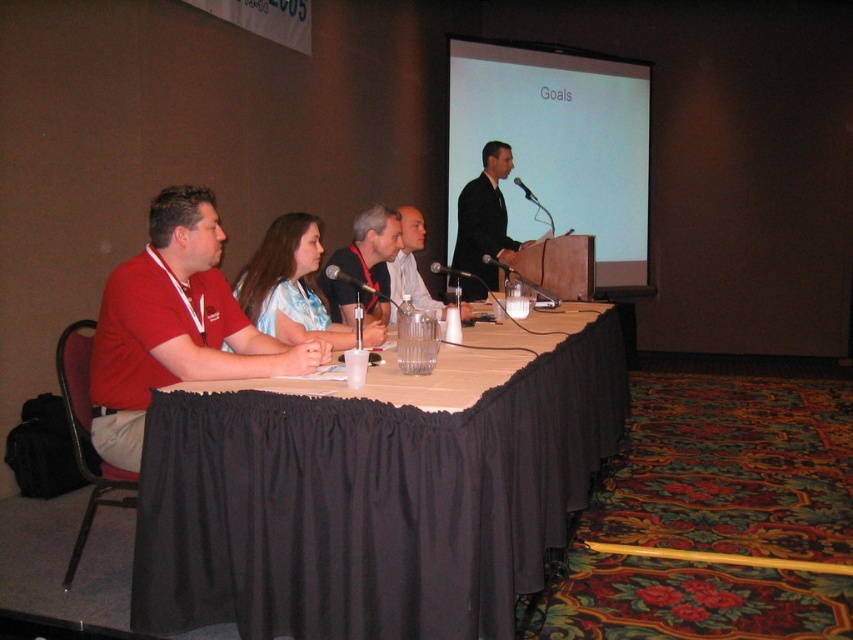
You are an attendee at this meeting and want to present a slide from the white matte projection screen at upper center to the person in the black suit at center. Can you directly hand the slide to them without moving from your seat?

The white matte projection screen at upper center is located above the black suit at center, so you cannot directly hand the slide to them because the screen is positioned above the person, not within reach from your seat.

You are an attendee in the conference room. You need to present a slide that will be displayed on the white matte projection screen at upper center. Where exactly should you position yourself to ensure your presentation is visible on the screen?

To ensure your presentation is visible on the white matte projection screen at upper center, you should position yourself directly in front of the screen at point (556, 145).